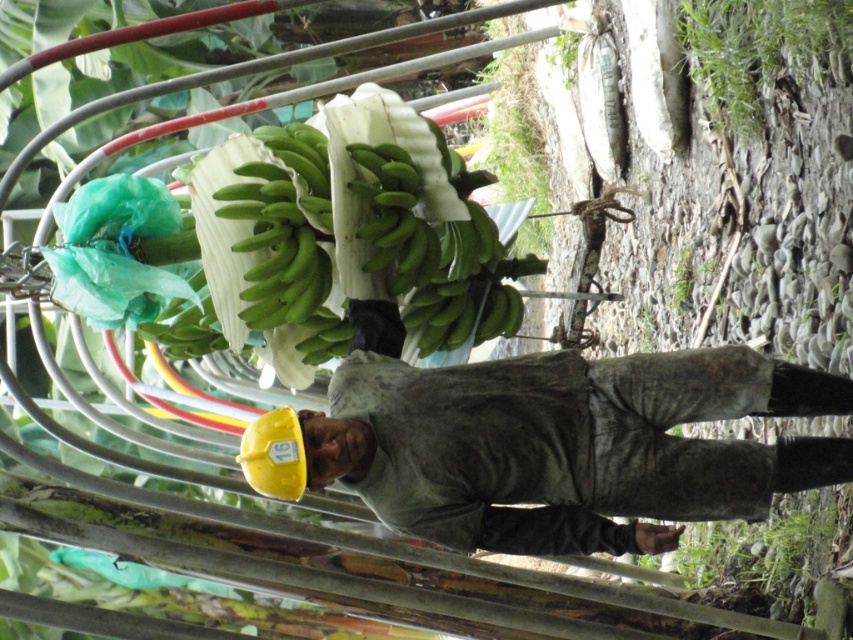
Which is in front, point (419, 500) or point (405, 218)?

Point (419, 500) is more forward.

Is point (668, 369) positioned after point (415, 301)?

No, (668, 369) is in front of (415, 301).

I want to click on yellow hard hat at center, so coord(577,444).